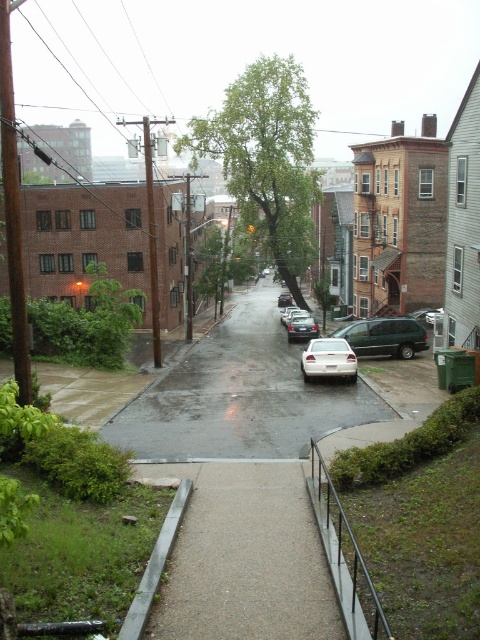
Which is above, wet asphalt road at center or green leafy tree at center?

Positioned higher is green leafy tree at center.

Does wet asphalt road at center have a greater width compared to green leafy tree at center?

Incorrect, wet asphalt road at center's width does not surpass green leafy tree at center's.

Is point (204, 419) behind point (224, 125)?

No, it is in front of (224, 125).

You are a GUI agent. You are given a task and a screenshot of the screen. Output one action in this format:
    pyautogui.click(x=<x>, y=<y>)
    Task: Click on the wet asphalt road at center
    This screenshot has height=640, width=480.
    Given the screenshot: What is the action you would take?
    pyautogui.click(x=240, y=396)

Is point (256, 205) closer to viewer compared to point (142, 611)?

No, it is not.

Where is `green leafy tree at center`? The width and height of the screenshot is (480, 640). green leafy tree at center is located at coordinates (266, 157).

Is point (305, 362) less distant than point (288, 340)?

Yes.

Which is more to the right, white matte sedan at center or satin silver sedan at center?

From the viewer's perspective, satin silver sedan at center appears more on the right side.

Who is more distant from viewer, (x=338, y=368) or (x=312, y=324)?

The point (x=312, y=324) is more distant.

You are a GUI agent. You are given a task and a screenshot of the screen. Output one action in this format:
    pyautogui.click(x=<x>, y=<y>)
    Task: Click on the white matte sedan at center
    The image size is (480, 640).
    Given the screenshot: What is the action you would take?
    pyautogui.click(x=328, y=358)